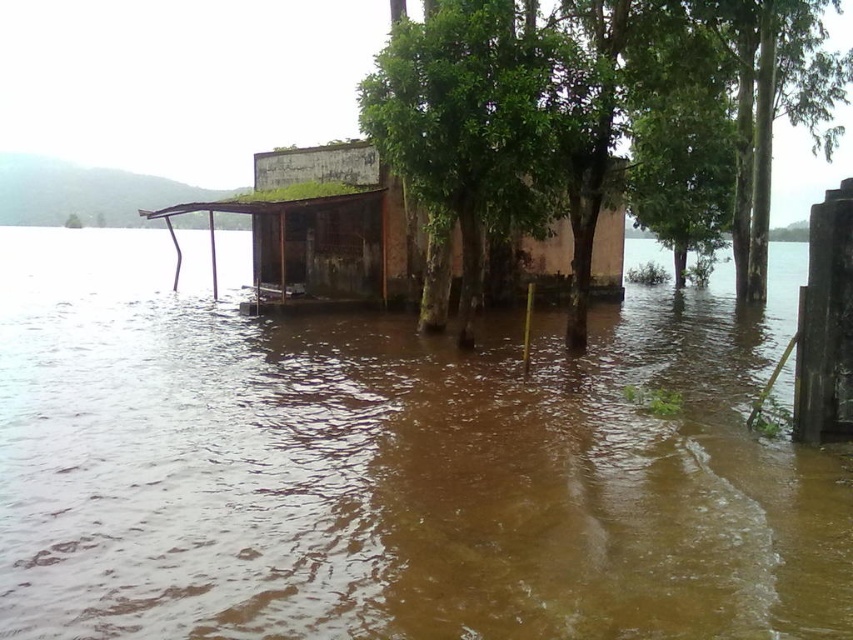
Is brown muddy water at center shorter than green leafy tree at center?

Indeed, brown muddy water at center has a lesser height compared to green leafy tree at center.

Is point (550, 490) positioned after point (781, 108)?

No, (550, 490) is closer to viewer.

I want to click on brown muddy water at center, so click(x=392, y=468).

Can you confirm if green leafy tree at center is positioned to the right of rusty metal hut at center?

Correct, you'll find green leafy tree at center to the right of rusty metal hut at center.

Describe the element at coordinates (584, 109) in the screenshot. I see `green leafy tree at center` at that location.

Between point (840, 1) and point (281, 241), which one is positioned in front?

Point (281, 241) is more forward.

The height and width of the screenshot is (640, 853). In order to click on green leafy tree at center in this screenshot , I will do (x=584, y=109).

The height and width of the screenshot is (640, 853). What do you see at coordinates (392, 468) in the screenshot?
I see `brown muddy water at center` at bounding box center [392, 468].

Does brown muddy water at center appear over rusty metal hut at center?

Incorrect, brown muddy water at center is not positioned above rusty metal hut at center.

Does point (424, 456) lie in front of point (294, 234)?

Yes, point (424, 456) is in front of point (294, 234).

Locate an element on the screen. This screenshot has height=640, width=853. brown muddy water at center is located at coordinates (392, 468).